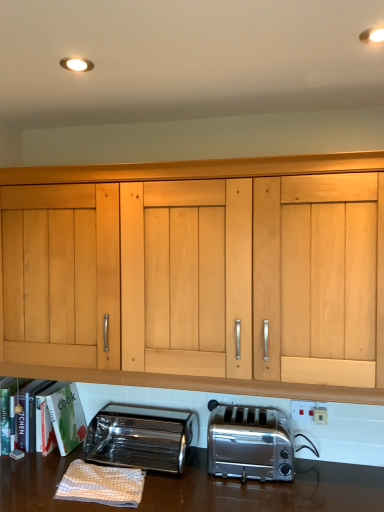
The width and height of the screenshot is (384, 512). I want to click on hardcover books at lower left, so click(50, 417).

What is the approximate width of polished stainless steel toaster at lower left, arranged as the first toaster when viewed from the left?

It is 11.36 inches.

Find the location of `satin silver toaster at lower center, positioned as the first toaster in right-to-left order`. satin silver toaster at lower center, positioned as the first toaster in right-to-left order is located at coordinates (250, 443).

Measure the distance between white plastic electric outlet at center, the 2th electric outlet viewed from the right, and camera.

A distance of 1.77 meters exists between white plastic electric outlet at center, the 2th electric outlet viewed from the right, and camera.

Describe the element at coordinates (309, 411) in the screenshot. I see `white plastic electrical outlet at lower center, the first electric outlet viewed from the front` at that location.

This screenshot has width=384, height=512. I want to click on hardcover books at lower left, so pos(50,417).

Is satin silver toaster at lower center, the 2th toaster from the left, not close to white plastic electric outlet at center, arranged as the first electric outlet when viewed from the back?

No, there isn't a large distance between satin silver toaster at lower center, the 2th toaster from the left, and white plastic electric outlet at center, arranged as the first electric outlet when viewed from the back.

Locate an element on the screen. The image size is (384, 512). the 1st toaster below the white plastic electric outlet at center, placed as the second electric outlet when sorted from front to back (from the image's perspective) is located at coordinates (250, 443).

How different are the orientations of satin silver toaster at lower center, the 2th toaster from the left, and white plastic electric outlet at center, the 2th electric outlet viewed from the right, in degrees?

There is a 0.747-degree angle between the facing directions of satin silver toaster at lower center, the 2th toaster from the left, and white plastic electric outlet at center, the 2th electric outlet viewed from the right.

Can you confirm if satin silver toaster at lower center, the 2th toaster from the left, is shorter than white plastic electric outlet at center, the 2th electric outlet viewed from the right?

No.

Is there a large distance between satin silver toaster at lower center, positioned as the first toaster in right-to-left order, and hardcover books at lower left?

satin silver toaster at lower center, positioned as the first toaster in right-to-left order, is near hardcover books at lower left, not far away.

From a real-world perspective, which object rests below the other?

satin silver toaster at lower center, the 2th toaster from the left, from a real-world perspective.

Does satin silver toaster at lower center, the 2th toaster from the left, have a greater width compared to hardcover books at lower left?

In fact, satin silver toaster at lower center, the 2th toaster from the left, might be narrower than hardcover books at lower left.

Is satin silver toaster at lower center, positioned as the first toaster in right-to-left order, not within hardcover books at lower left?

Yes, satin silver toaster at lower center, positioned as the first toaster in right-to-left order, is outside of hardcover books at lower left.

Is hardcover books at lower left turned away from white plastic electric outlet at center, the 2th electric outlet viewed from the right?

No, hardcover books at lower left's orientation is not away from white plastic electric outlet at center, the 2th electric outlet viewed from the right.

Is hardcover books at lower left not within white plastic electric outlet at center, arranged as the first electric outlet when viewed from the back?

Yes.

Which object is further away from the camera taking this photo, hardcover books at lower left or white plastic electric outlet at center, arranged as the first electric outlet when viewed from the back?

white plastic electric outlet at center, arranged as the first electric outlet when viewed from the back.

Is hardcover books at lower left next to white plastic electric outlet at center, arranged as the first electric outlet when viewed from the back?

No, hardcover books at lower left is not making contact with white plastic electric outlet at center, arranged as the first electric outlet when viewed from the back.

Measure the distance from white checkered cloth at lower left to satin silver toaster at lower center, the 2th toaster from the left.

They are 16.58 inches apart.

Is point (141, 494) closer or farther from the camera than point (242, 455)?

Point (141, 494) is closer to the camera than point (242, 455).

Is white checkered cloth at lower left far away from satin silver toaster at lower center, positioned as the first toaster in right-to-left order?

That's not correct — white checkered cloth at lower left is a little close to satin silver toaster at lower center, positioned as the first toaster in right-to-left order.

Is white checkered cloth at lower left closer to camera compared to satin silver toaster at lower center, positioned as the first toaster in right-to-left order?

Yes, the depth of white checkered cloth at lower left is less than that of satin silver toaster at lower center, positioned as the first toaster in right-to-left order.

Does polished stainless steel toaster at lower left, arranged as the first toaster when viewed from the left, come behind hardcover books at lower left?

No.

From the image's perspective, is polished stainless steel toaster at lower left, which is the 2th toaster from right to left, below hardcover books at lower left?

Yes, from the image's perspective, polished stainless steel toaster at lower left, which is the 2th toaster from right to left, is below hardcover books at lower left.

Based on their positions, is polished stainless steel toaster at lower left, which is the 2th toaster from right to left, located to the left or right of hardcover books at lower left?

In the image, polished stainless steel toaster at lower left, which is the 2th toaster from right to left, appears on the right side of hardcover books at lower left.

Are polished stainless steel toaster at lower left, arranged as the first toaster when viewed from the left, and hardcover books at lower left beside each other?

There is a gap between polished stainless steel toaster at lower left, arranged as the first toaster when viewed from the left, and hardcover books at lower left.

The image size is (384, 512). In order to click on bookshelf located on the left of white plastic electrical outlet at lower center, which appears as the 1th electric outlet when viewed from the right in this screenshot , I will do `click(50, 417)`.

Can you confirm if hardcover books at lower left is positioned to the left of white plastic electrical outlet at lower center, which appears as the 1th electric outlet when viewed from the right?

Yes.

From the picture: Is hardcover books at lower left looking in the opposite direction of white plastic electrical outlet at lower center, which is the second electric outlet in left-to-right order?

No.

Consider the image. Is hardcover books at lower left inside the boundaries of white plastic electrical outlet at lower center, which appears as the 1th electric outlet when viewed from the right, or outside?

hardcover books at lower left exists outside the volume of white plastic electrical outlet at lower center, which appears as the 1th electric outlet when viewed from the right.

From a real-world perspective, count 1st toasters downward from the hardcover books at lower left and point to it. Please provide its 2D coordinates.

[(250, 443)]

Choose the correct answer: Is hardcover books at lower left inside satin silver toaster at lower center, the 2th toaster from the left, or outside it?

hardcover books at lower left is spatially situated outside satin silver toaster at lower center, the 2th toaster from the left.

Is hardcover books at lower left facing towards satin silver toaster at lower center, positioned as the first toaster in right-to-left order?

No, hardcover books at lower left is not facing towards satin silver toaster at lower center, positioned as the first toaster in right-to-left order.

Considering the sizes of objects hardcover books at lower left and satin silver toaster at lower center, positioned as the first toaster in right-to-left order, in the image provided, who is wider, hardcover books at lower left or satin silver toaster at lower center, positioned as the first toaster in right-to-left order,?

hardcover books at lower left.

You are a GUI agent. You are given a task and a screenshot of the screen. Output one action in this format:
    pyautogui.click(x=<x>, y=<y>)
    Task: Click on the toaster that is the 2nd object located in front of the white plastic electric outlet at center, which is counted as the 1th electric outlet, starting from the left
    
    Given the screenshot: What is the action you would take?
    pyautogui.click(x=250, y=443)

You are a GUI agent. You are given a task and a screenshot of the screen. Output one action in this format:
    pyautogui.click(x=<x>, y=<y>)
    Task: Click on the 1st toaster below the hardcover books at lower left (from the image's perspective)
    The image size is (384, 512).
    Given the screenshot: What is the action you would take?
    pyautogui.click(x=250, y=443)

Looking at the image, which one is located further to white checkered cloth at lower left, polished stainless steel toaster at lower left, arranged as the first toaster when viewed from the left, or hardcover books at lower left?

The object further to white checkered cloth at lower left is hardcover books at lower left.

Estimate the real-world distances between objects in this image. Which object is further from white checkered cloth at lower left, white plastic electrical outlet at lower center, which appears as the 1th electric outlet when viewed from the right, or satin silver toaster at lower center, the 2th toaster from the left?

white plastic electrical outlet at lower center, which appears as the 1th electric outlet when viewed from the right, lies further to white checkered cloth at lower left than the other object.

When comparing their distances from white plastic electrical outlet at lower center, which is the second electric outlet in left-to-right order, does white plastic electric outlet at center, the 2th electric outlet viewed from the right, or satin silver toaster at lower center, the 2th toaster from the left, seem closer?

satin silver toaster at lower center, the 2th toaster from the left, is closer to white plastic electrical outlet at lower center, which is the second electric outlet in left-to-right order.

When comparing their distances from white checkered cloth at lower left, does white plastic electrical outlet at lower center, which is the second electric outlet in left-to-right order, or white plastic electric outlet at center, placed as the second electric outlet when sorted from front to back, seem further?

white plastic electrical outlet at lower center, which is the second electric outlet in left-to-right order, is further to white checkered cloth at lower left.

From the image, which object appears to be nearer to hardcover books at lower left, white plastic electrical outlet at lower center, which appears as the 1th electric outlet when viewed from the right, or satin silver toaster at lower center, the 2th toaster from the left?

satin silver toaster at lower center, the 2th toaster from the left, is closer to hardcover books at lower left.

When comparing their distances from hardcover books at lower left, does white plastic electrical outlet at lower center, which appears as the 1th electric outlet when viewed from the right, or polished stainless steel toaster at lower left, which is the 2th toaster from right to left, seem closer?

Among the two, polished stainless steel toaster at lower left, which is the 2th toaster from right to left, is located nearer to hardcover books at lower left.

From the image, which object appears to be nearer to white plastic electrical outlet at lower center, which appears as the 1th electric outlet when viewed from the right, polished stainless steel toaster at lower left, arranged as the first toaster when viewed from the left, or white plastic electric outlet at center, which is counted as the 1th electric outlet, starting from the left?

white plastic electric outlet at center, which is counted as the 1th electric outlet, starting from the left, is closer to white plastic electrical outlet at lower center, which appears as the 1th electric outlet when viewed from the right.

Looking at the image, which one is located further to white checkered cloth at lower left, white plastic electrical outlet at lower center, which is the second electric outlet in left-to-right order, or polished stainless steel toaster at lower left, arranged as the first toaster when viewed from the left?

Based on the image, white plastic electrical outlet at lower center, which is the second electric outlet in left-to-right order, appears to be further to white checkered cloth at lower left.

Image resolution: width=384 pixels, height=512 pixels. I want to click on toaster situated between polished stainless steel toaster at lower left, arranged as the first toaster when viewed from the left, and white plastic electrical outlet at lower center, which appears as the 1th electric outlet when viewed from the right, from left to right, so click(x=250, y=443).

This screenshot has height=512, width=384. Find the location of `toaster between white checkered cloth at lower left and white plastic electric outlet at center, which is counted as the 1th electric outlet, starting from the left, in the horizontal direction`. toaster between white checkered cloth at lower left and white plastic electric outlet at center, which is counted as the 1th electric outlet, starting from the left, in the horizontal direction is located at coordinates (140, 437).

Identify the location of material between hardcover books at lower left and polished stainless steel toaster at lower left, which is the 2th toaster from right to left, from left to right. (101, 484).

Identify the location of toaster between hardcover books at lower left and satin silver toaster at lower center, the 2th toaster from the left, in the horizontal direction. This screenshot has height=512, width=384. (140, 437).